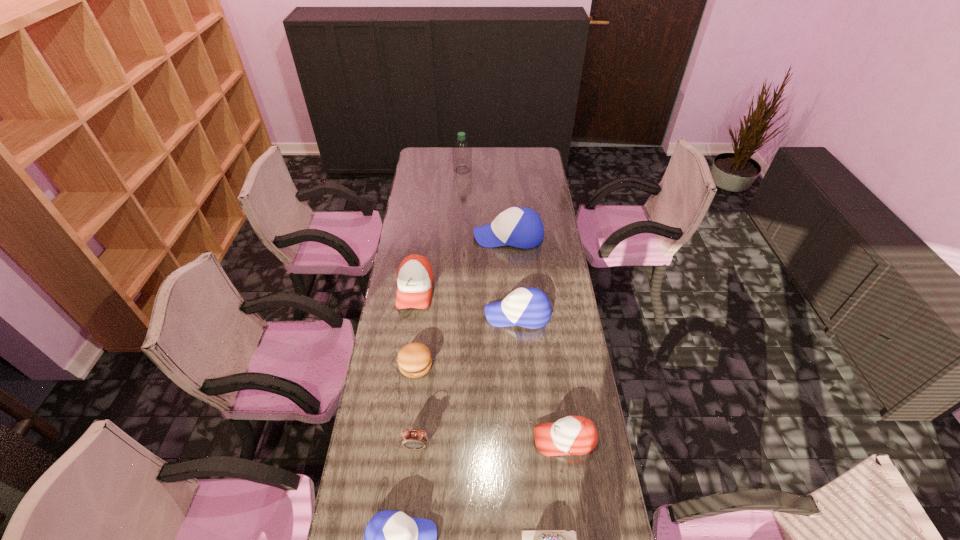
In the image, there is a desktop. In order to click on vacant space at the right edge in this screenshot , I will do `click(551, 284)`.

The width and height of the screenshot is (960, 540). I want to click on vacant space at the far left corner of the desktop, so click(433, 163).

In the image, there is a desktop. Find the location of `vacant area at the far right corner`. vacant area at the far right corner is located at coordinates (536, 150).

Identify the location of free spot between the hamburger and the alarm clock. (416, 406).

Locate an element on the screen. This screenshot has width=960, height=540. vacant region between the farthest white baseball cap and the alarm clock is located at coordinates (463, 341).

What are the coordinates of `vacant space that is in between the alarm clock and the second nearest baseball cap` in the screenshot? It's located at (491, 443).

Find the location of a particular element. The width and height of the screenshot is (960, 540). vacant space in between the hamburger and the alarm clock is located at coordinates (416, 406).

Where is `free point between the farthest white baseball cap and the farther orange baseball cap`? The width and height of the screenshot is (960, 540). free point between the farthest white baseball cap and the farther orange baseball cap is located at coordinates [462, 263].

This screenshot has width=960, height=540. I want to click on object that ranks as the second closest to the farther orange baseball cap, so click(x=520, y=227).

Point out which object is positioned as the fifth nearest to the cap. Please provide its 2D coordinates. Your answer should be formatted as a tuple, i.e. [(x, y)], where the tuple contains the x and y coordinates of a point satisfying the conditions above.

[(527, 307)]